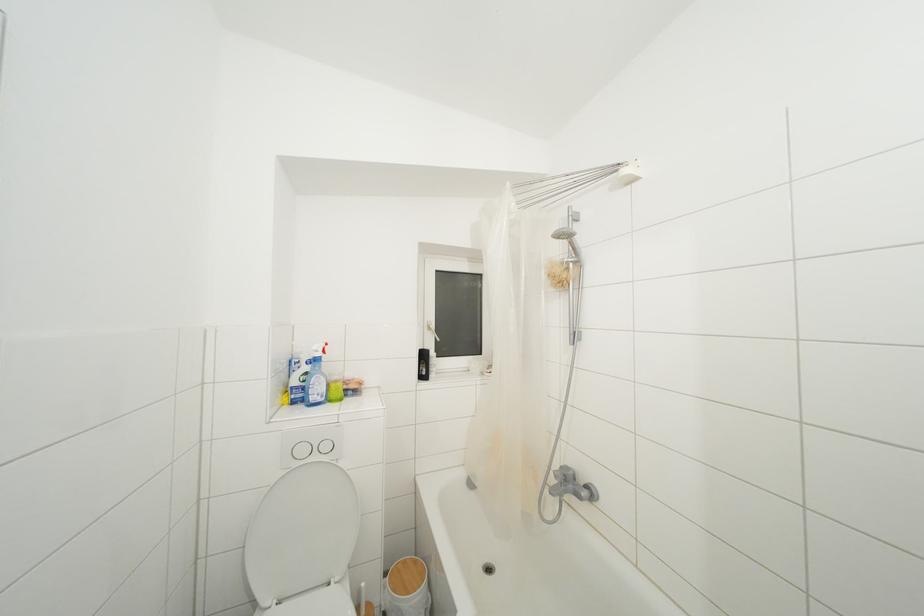
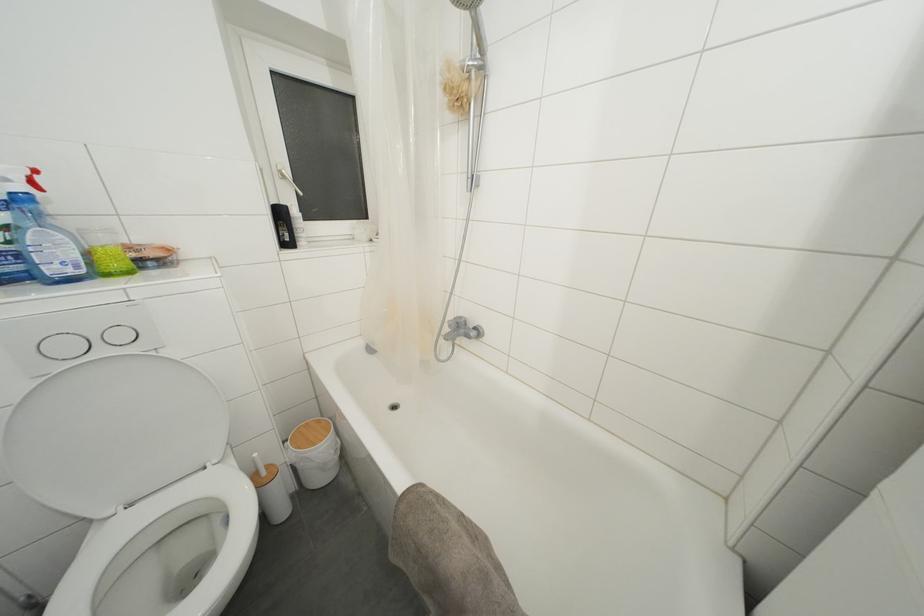
Find the pixel in the second image that matches (x=327, y=355) in the first image.

(37, 188)